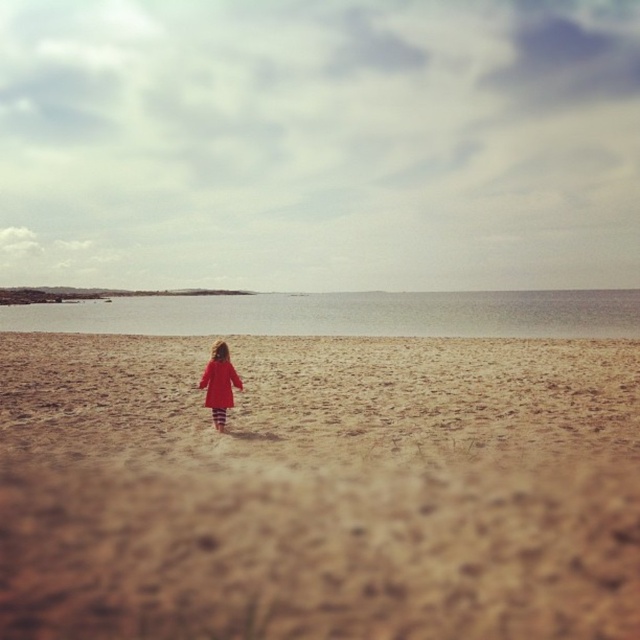
Question: Which of the following is the farthest from the observer?

Choices:
 (A) clear water at center
 (B) brown sandy beach at center
 (C) matte red coat at center

Answer: (A)

Question: Which of the following is the closest to the observer?

Choices:
 (A) clear water at center
 (B) brown sandy beach at center

Answer: (B)

Question: Can you confirm if brown sandy beach at center is positioned above clear water at center?

Choices:
 (A) yes
 (B) no

Answer: (B)

Question: Is clear water at center below matte red coat at center?

Choices:
 (A) yes
 (B) no

Answer: (B)

Question: Which of the following is the farthest from the observer?

Choices:
 (A) clear water at center
 (B) matte red coat at center
 (C) brown sandy beach at center

Answer: (A)

Question: Can you confirm if clear water at center is smaller than matte red coat at center?

Choices:
 (A) yes
 (B) no

Answer: (B)